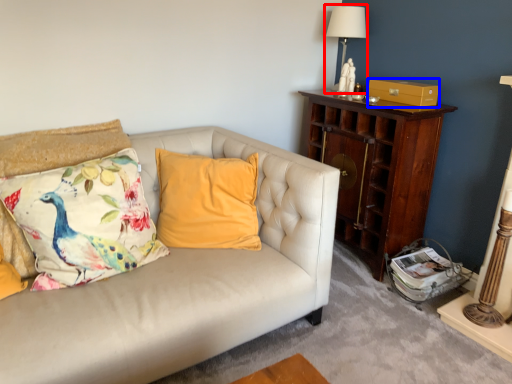
Question: Among these objects, which one is nearest to the camera, table lamp (highlighted by a red box) or drawer (highlighted by a blue box)?

Choices:
 (A) table lamp
 (B) drawer

Answer: (B)